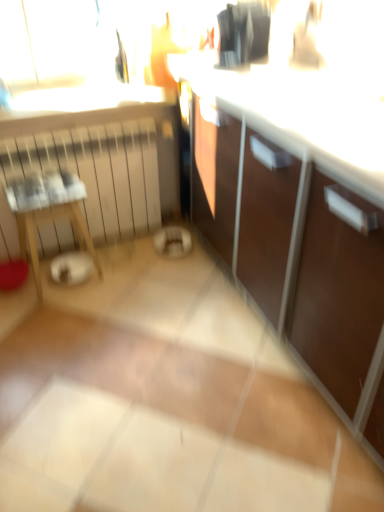
Question: Is wooden table at left wider or thinner than black glossy coffee maker at upper center?

Choices:
 (A) wide
 (B) thin

Answer: (B)

Question: Is wooden table at left taller or shorter than black glossy coffee maker at upper center?

Choices:
 (A) short
 (B) tall

Answer: (B)

Question: Which is farther from the white matte radiator at left?

Choices:
 (A) clear glass window sill at upper center
 (B) wooden table at left
 (C) black glossy coffee maker at upper center

Answer: (C)

Question: Considering the real-world distances, which object is farthest from the wooden table at left?

Choices:
 (A) white matte radiator at left
 (B) clear glass window sill at upper center
 (C) black glossy coffee maker at upper center

Answer: (C)